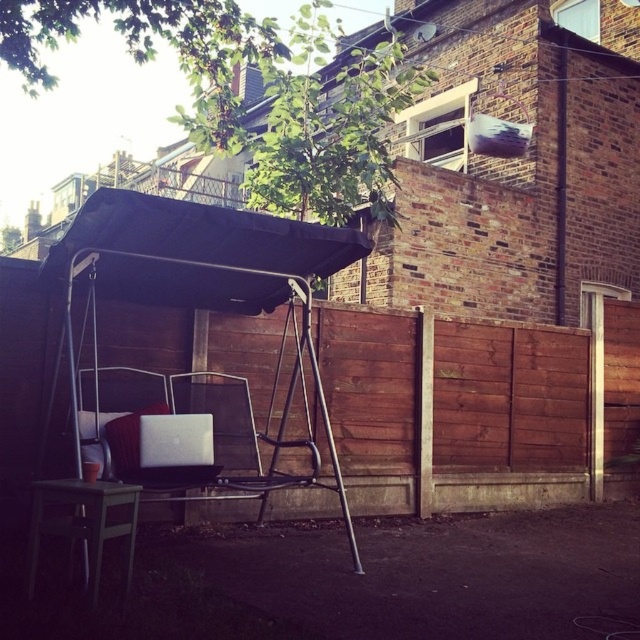
Question: Among these objects, which one is nearest to the camera?

Choices:
 (A) white fabric chair at center
 (B) silver metallic laptop at center

Answer: (B)

Question: Where is black fabric canopy at center located in relation to green matte stool at lower left in the image?

Choices:
 (A) below
 (B) above

Answer: (B)

Question: Among these objects, which one is farthest from the camera?

Choices:
 (A) black metal swing at center
 (B) silver metallic laptop at center
 (C) white fabric chair at center

Answer: (C)

Question: Which point is closer to the camera?

Choices:
 (A) (161, 243)
 (B) (145, 428)
 (C) (97, 564)
 (D) (144, 289)

Answer: (C)

Question: Is black fabric canopy at center closer to the viewer compared to silver metallic laptop at center?

Choices:
 (A) no
 (B) yes

Answer: (B)

Question: Is black fabric canopy at center below white fabric chair at center?

Choices:
 (A) no
 (B) yes

Answer: (A)